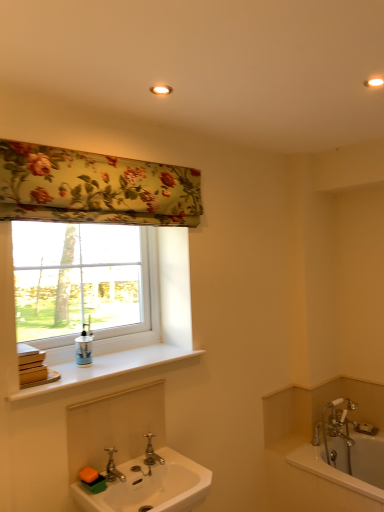
Question: From the image's perspective, is white matte window sill at upper left above or below chrome metallic faucet at lower center, the 2th tap positioned from the right?

Choices:
 (A) above
 (B) below

Answer: (A)

Question: Considering the positions of white matte window sill at upper left and chrome metallic faucet at lower center, the 2th tap positioned from the right, in the image, is white matte window sill at upper left taller or shorter than chrome metallic faucet at lower center, the 2th tap positioned from the right,?

Choices:
 (A) short
 (B) tall

Answer: (A)

Question: Estimate the real-world distances between objects in this image. Which object is farther from the white glossy bathtub at lower right?

Choices:
 (A) white glossy sink at lower left
 (B) polished brass faucet at sink center, placed as the 1th tap when sorted from back to front
 (C) white matte window sill at upper left
 (D) white glossy soap dispenser at window
 (E) white plastic window at upper left

Answer: (E)

Question: Which of these objects is positioned farthest from the white glossy bathtub at lower right?

Choices:
 (A) matte white recessed light at upper center
 (B) white glossy soap dispenser at window
 (C) floral fabric at upper left
 (D) white glossy sink at lower left
 (E) white matte window sill at upper left

Answer: (A)